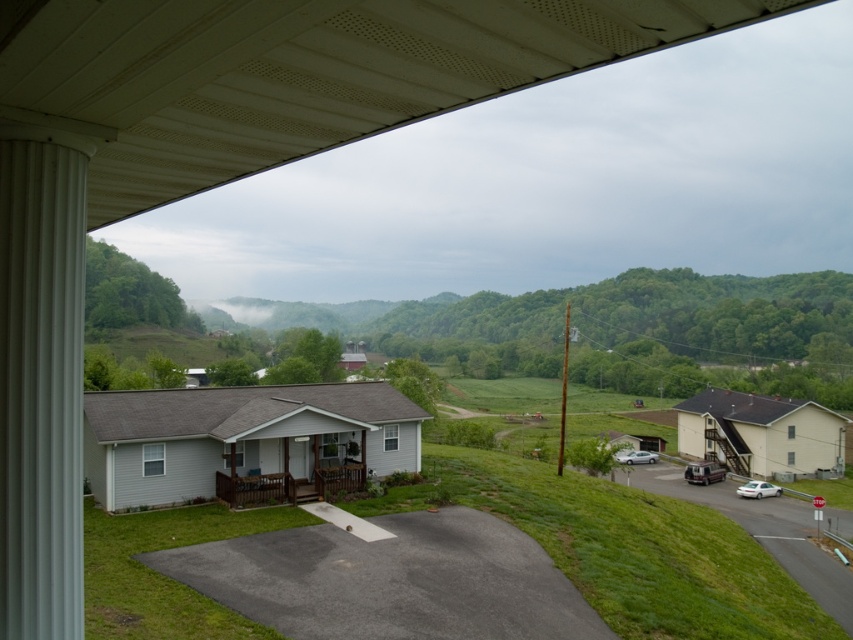
You are standing on the brown wooden porch at lower center and want to move to the metallic silver van at lower right. Which direction should you walk to get closer to the van?

Since the brown wooden porch at lower center has a lesser width compared to metallic silver van at lower right, you should walk towards the right side of the porch to move closer to the van.

You are standing on the driveway and want to walk to the white glossy sedan at lower right. Which direction should you head relative to the brown wooden porch at lower center?

You should head to the right of the brown wooden porch at lower center to reach the white glossy sedan at lower right because the sedan is positioned to the right of the porch.

You are standing on the brown wooden porch at lower center and want to walk to the white glossy sedan at lower right. Is the sedan behind or in front of you?

The brown wooden porch at lower center is in front of the white glossy sedan at lower right, so the sedan is behind you.